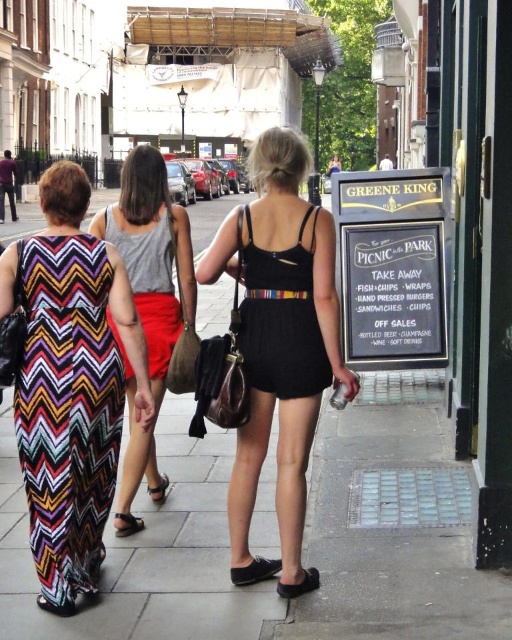
Which is in front, point (83, 557) or point (278, 563)?

Point (83, 557) is in front.

Does point (78, 568) come behind point (263, 561)?

No, (78, 568) is in front of (263, 561).

I want to click on multicolored zigzag fabric dress at center, so click(68, 406).

Can you confirm if black chalkboard sign at right is positioned to the left of black suede shoe at lower center?

In fact, black chalkboard sign at right is to the right of black suede shoe at lower center.

Can you confirm if black chalkboard sign at right is bigger than black suede shoe at lower center?

Yes, black chalkboard sign at right is bigger than black suede shoe at lower center.

Does point (414, 262) come in front of point (244, 579)?

No, it is not.

Locate an element on the screen. This screenshot has width=512, height=640. black chalkboard sign at right is located at coordinates (393, 266).

How much distance is there between multicolored zigzag dress at center and black suede sandal at lower center?

They are 1.87 meters apart.

Is multicolored zigzag dress at center above black suede sandal at lower center?

Yes.

This screenshot has width=512, height=640. What are the coordinates of `multicolored zigzag dress at center` in the screenshot? It's located at (152, 256).